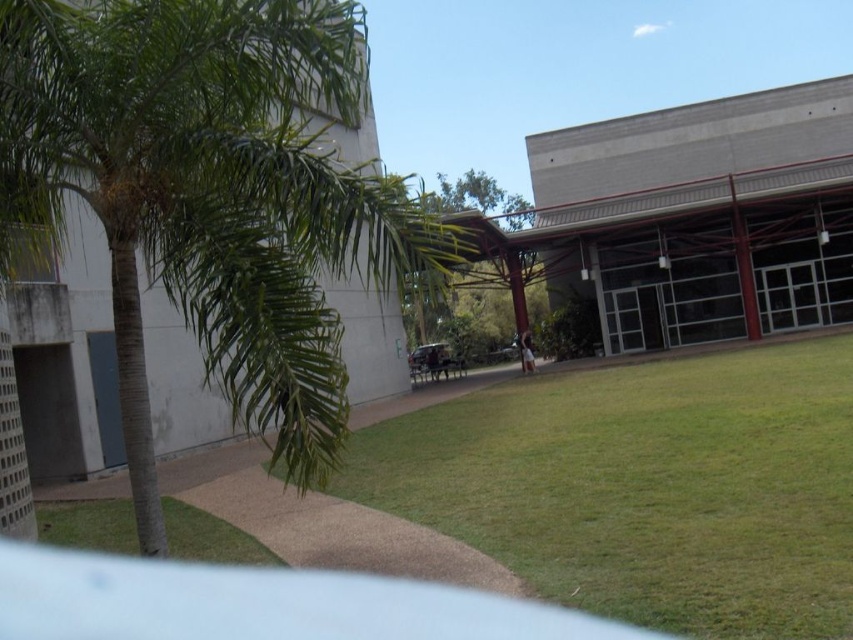
Question: Which point is closer to the camera taking this photo?

Choices:
 (A) (100, 68)
 (B) (479, 200)

Answer: (A)

Question: Which of the following is the farthest from the observer?

Choices:
 (A) green leafy tree at center
 (B) green leafy palm tree at left

Answer: (A)

Question: From the image, what is the correct spatial relationship of green leafy palm tree at left in relation to green leafy tree at center?

Choices:
 (A) below
 (B) above

Answer: (A)

Question: Does green leafy palm tree at left have a smaller size compared to green leafy tree at center?

Choices:
 (A) no
 (B) yes

Answer: (B)

Question: Is green leafy palm tree at left to the right of green leafy tree at center from the viewer's perspective?

Choices:
 (A) yes
 (B) no

Answer: (B)

Question: Among these objects, which one is nearest to the camera?

Choices:
 (A) green leafy tree at center
 (B) green leafy palm tree at left

Answer: (B)